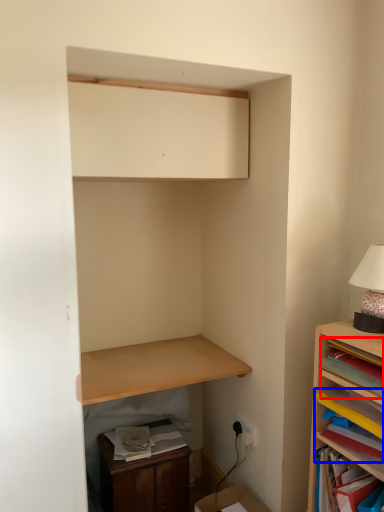
Question: Which of the following is the closest to the observer, book (highlighted by a red box) or book (highlighted by a blue box)?

Choices:
 (A) book
 (B) book

Answer: (A)